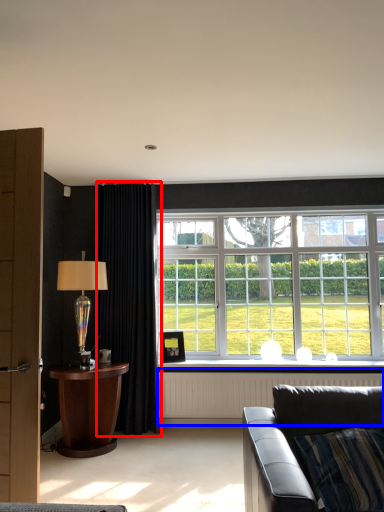
Question: Which point is further to the camera, curtain (highlighted by a red box) or radiator (highlighted by a blue box)?

Choices:
 (A) curtain
 (B) radiator

Answer: (B)